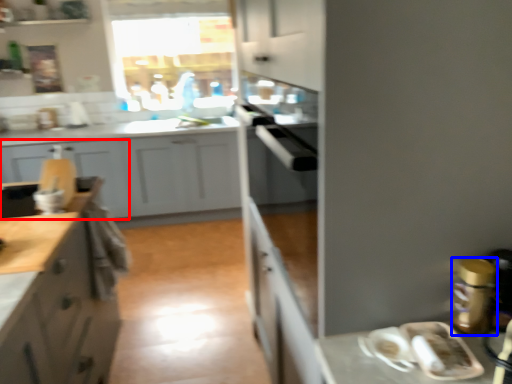
Question: Which object appears farthest to the camera in this image, cabinetry (highlighted by a red box) or appliance (highlighted by a blue box)?

Choices:
 (A) cabinetry
 (B) appliance

Answer: (A)